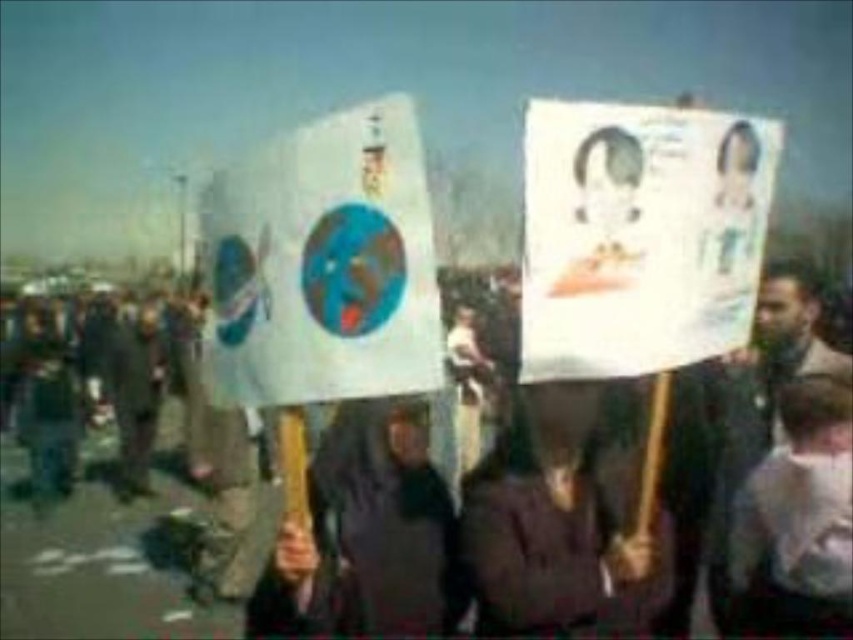
Does white paper poster at upper center appear under white cardboard poster at center?

No, white paper poster at upper center is not below white cardboard poster at center.

Who is shorter, white paper poster at upper center or white cardboard poster at center?

white cardboard poster at center

Identify the location of white paper poster at upper center. [x=639, y=236].

The height and width of the screenshot is (640, 853). In order to click on white paper poster at upper center in this screenshot , I will do `click(639, 236)`.

Does white cardboard poster at center have a greater height compared to dark brown fabric at center?

No, white cardboard poster at center is not taller than dark brown fabric at center.

Who is lower down, white cardboard poster at center or dark brown fabric at center?

dark brown fabric at center is below.

Identify the location of white cardboard poster at center. pyautogui.click(x=323, y=266).

Locate an element on the screen. white cardboard poster at center is located at coordinates (323, 266).

Which of these two, white cardboard poster at center or white cotton shirt at center, stands shorter?

white cardboard poster at center

Which is in front, point (335, 179) or point (781, 397)?

Positioned in front is point (335, 179).

Based on the photo, who is more distant from viewer, (337, 163) or (845, 547)?

The point (845, 547) is more distant.

Where is `white cardboard poster at center`? This screenshot has width=853, height=640. white cardboard poster at center is located at coordinates (323, 266).